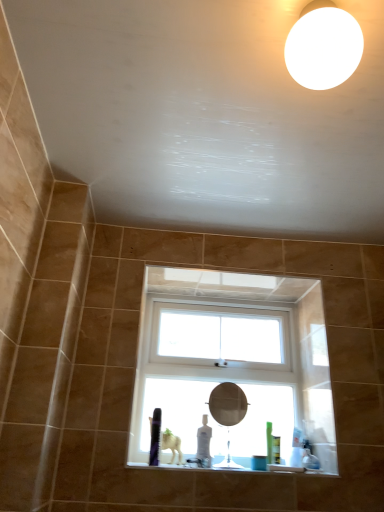
Question: Does matte silver mirror at center come behind white matte light fixture at upper right?

Choices:
 (A) no
 (B) yes

Answer: (B)

Question: From the image's perspective, does matte silver mirror at center appear lower than white matte light fixture at upper right?

Choices:
 (A) yes
 (B) no

Answer: (A)

Question: Is matte silver mirror at center in front of white matte light fixture at upper right?

Choices:
 (A) no
 (B) yes

Answer: (A)

Question: Does matte silver mirror at center turn towards white matte light fixture at upper right?

Choices:
 (A) no
 (B) yes

Answer: (B)

Question: Does matte silver mirror at center have a lesser width compared to white matte light fixture at upper right?

Choices:
 (A) yes
 (B) no

Answer: (A)

Question: Is matte silver mirror at center taller than white matte light fixture at upper right?

Choices:
 (A) no
 (B) yes

Answer: (B)

Question: Is white glossy window sill at lower center facing away from matte silver mirror at center?

Choices:
 (A) no
 (B) yes

Answer: (A)

Question: Does white glossy window sill at lower center turn towards matte silver mirror at center?

Choices:
 (A) yes
 (B) no

Answer: (B)

Question: Is matte silver mirror at center surrounded by white glossy window sill at lower center?

Choices:
 (A) yes
 (B) no

Answer: (B)

Question: Is white glossy window sill at lower center further to camera compared to matte silver mirror at center?

Choices:
 (A) yes
 (B) no

Answer: (B)

Question: Is white glossy window sill at lower center smaller than matte silver mirror at center?

Choices:
 (A) yes
 (B) no

Answer: (A)

Question: Does white glossy window sill at lower center lie in front of matte silver mirror at center?

Choices:
 (A) yes
 (B) no

Answer: (A)

Question: Can you confirm if white plastic window at center is positioned to the right of matte silver mirror at center?

Choices:
 (A) yes
 (B) no

Answer: (B)